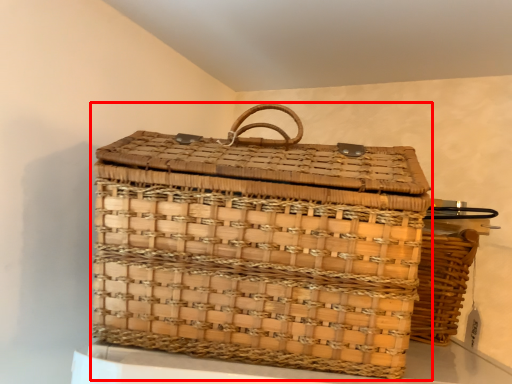
Question: Considering the relative positions of picnic basket (annotated by the red box) and picnic basket in the image provided, where is picnic basket (annotated by the red box) located with respect to the staircase?

Choices:
 (A) left
 (B) right

Answer: (A)